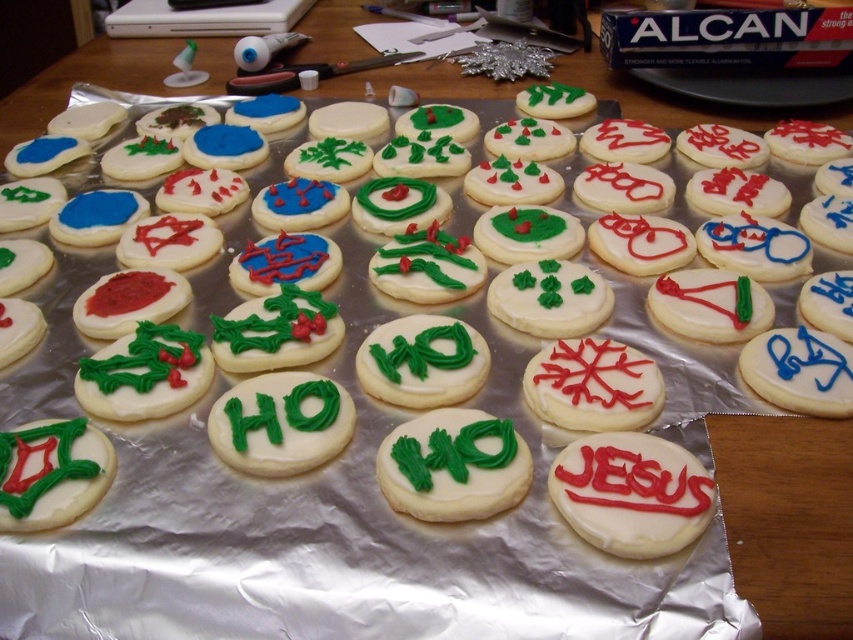
From the picture: Which is below, white smooth cookie at center or green frosting cookie at center?

green frosting cookie at center is below.

Does white smooth cookie at center have a greater width compared to green frosting cookie at center?

Indeed, white smooth cookie at center has a greater width compared to green frosting cookie at center.

The image size is (853, 640). I want to click on white smooth cookie at center, so click(x=720, y=221).

In the scene shown: Can you confirm if green frosted cookie with white icing at center is smaller than green frosting cookie at center?

Yes, green frosted cookie with white icing at center is smaller than green frosting cookie at center.

What do you see at coordinates (453, 465) in the screenshot? The height and width of the screenshot is (640, 853). I see `green frosted cookie with white icing at center` at bounding box center [453, 465].

Is point (463, 419) farther from viewer compared to point (328, 452)?

Yes, it is.

Where is `green frosted cookie with white icing at center`? green frosted cookie with white icing at center is located at coordinates (453, 465).

Is white smooth cookie at center behind green frosted cookie with white icing at center?

Yes, white smooth cookie at center is further from the viewer.

Which is more to the right, white smooth cookie at center or green frosted cookie with white icing at center?

Positioned to the right is green frosted cookie with white icing at center.

The height and width of the screenshot is (640, 853). I want to click on white smooth cookie at center, so click(x=720, y=221).